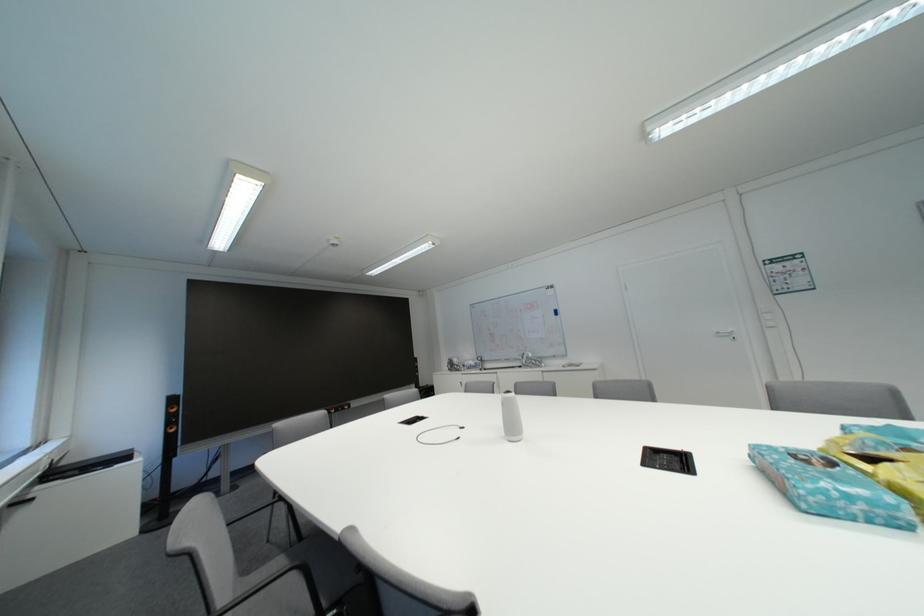
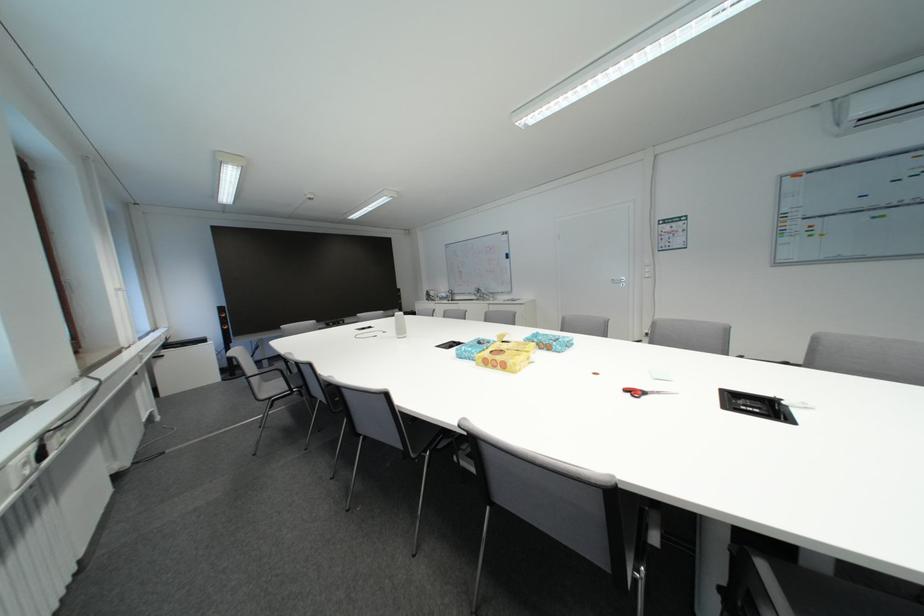
Find the pixel in the second image that matches the point at 502,337 in the first image.

(470, 275)